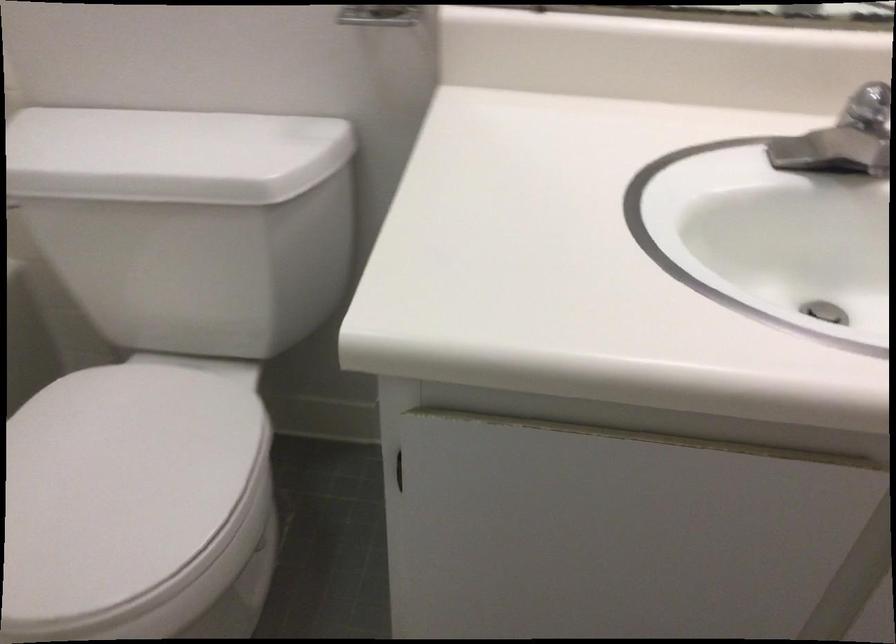
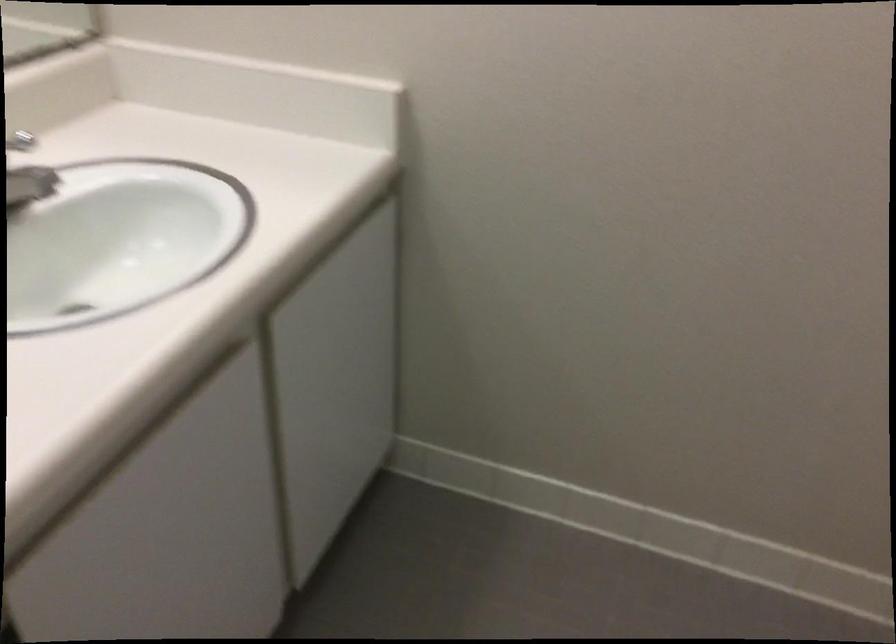
Based on the continuous images, in which direction is the camera rotating?

The camera rotated toward right-down.